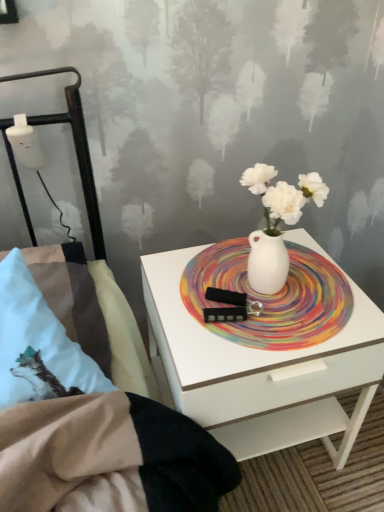
Where is `vacant space underneath rainbow painted platter at center (from a real-world perspective)`? The image size is (384, 512). vacant space underneath rainbow painted platter at center (from a real-world perspective) is located at coordinates (242, 263).